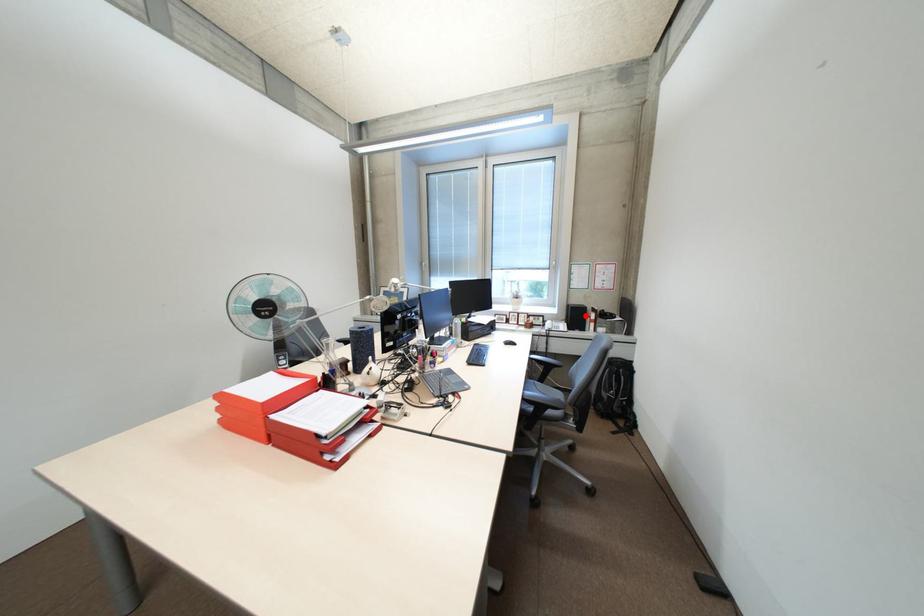
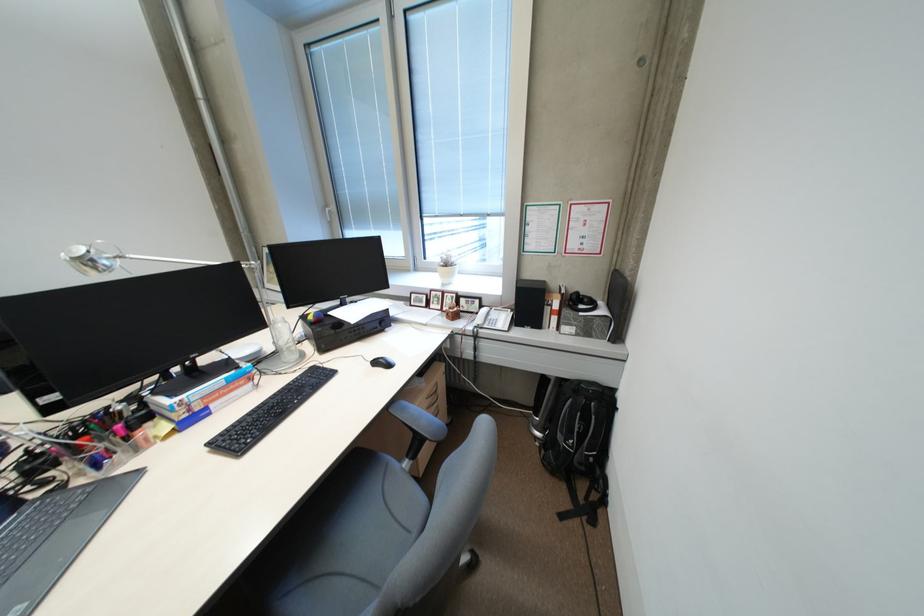
Where in the second image is the point corresponding to the highlighted location from the first image?

(538, 302)